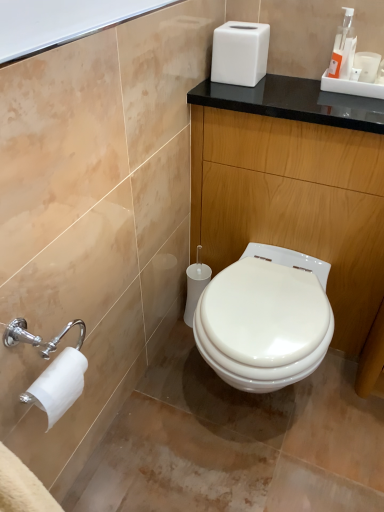
Question: Is the position of white matte toilet paper at lower left more distant than that of orange plastic soap dispenser at upper right?

Choices:
 (A) yes
 (B) no

Answer: (B)

Question: Is white matte toilet paper at lower left at the right side of orange plastic soap dispenser at upper right?

Choices:
 (A) no
 (B) yes

Answer: (A)

Question: Are white matte toilet paper at lower left and orange plastic soap dispenser at upper right far apart?

Choices:
 (A) yes
 (B) no

Answer: (A)

Question: Is white matte toilet paper at lower left bigger than orange plastic soap dispenser at upper right?

Choices:
 (A) no
 (B) yes

Answer: (B)

Question: From a real-world perspective, is white matte toilet paper at lower left physically below orange plastic soap dispenser at upper right?

Choices:
 (A) yes
 (B) no

Answer: (A)

Question: From a real-world perspective, is black glossy counter at center above or below white matte tissue box at upper center?

Choices:
 (A) below
 (B) above

Answer: (A)

Question: Looking at the image, does black glossy counter at center seem bigger or smaller compared to white matte tissue box at upper center?

Choices:
 (A) big
 (B) small

Answer: (A)

Question: Looking at their shapes, would you say black glossy counter at center is wider or thinner than white matte tissue box at upper center?

Choices:
 (A) thin
 (B) wide

Answer: (B)

Question: Does point (329, 259) appear closer or farther from the camera than point (258, 75)?

Choices:
 (A) closer
 (B) farther

Answer: (B)

Question: From a real-world perspective, is white matte toilet paper at lower left physically located above or below white matte tissue box at upper center?

Choices:
 (A) below
 (B) above

Answer: (A)

Question: Is white matte toilet paper at lower left inside or outside of white matte tissue box at upper center?

Choices:
 (A) inside
 (B) outside

Answer: (B)

Question: Considering the relative positions of white matte toilet paper at lower left and white matte tissue box at upper center in the image provided, is white matte toilet paper at lower left to the left or to the right of white matte tissue box at upper center?

Choices:
 (A) left
 (B) right

Answer: (A)

Question: Considering the positions of white matte toilet paper at lower left and white matte tissue box at upper center in the image, is white matte toilet paper at lower left taller or shorter than white matte tissue box at upper center?

Choices:
 (A) tall
 (B) short

Answer: (B)

Question: Would you say white matte tissue box at upper center is inside or outside white matte toilet paper at lower left?

Choices:
 (A) inside
 (B) outside

Answer: (B)

Question: Is point (246, 76) closer or farther from the camera than point (52, 370)?

Choices:
 (A) farther
 (B) closer

Answer: (A)